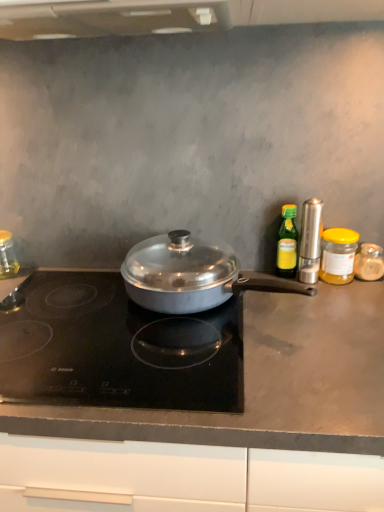
Question: Considering the relative positions of translucent glass jar at right, placed as the sixth kitchen appliance when sorted from left to right, and green glass bottle at right, which is the fourth kitchen appliance from right to left, in the image provided, is translucent glass jar at right, placed as the sixth kitchen appliance when sorted from left to right, behind green glass bottle at right, which is the fourth kitchen appliance from right to left,?

Choices:
 (A) yes
 (B) no

Answer: (A)

Question: From the image's perspective, is translucent glass jar at right, which is counted as the 1th kitchen appliance, starting from the right, on top of green glass bottle at right, which is the fourth kitchen appliance from right to left?

Choices:
 (A) yes
 (B) no

Answer: (B)

Question: Does translucent glass jar at right, placed as the sixth kitchen appliance when sorted from left to right, turn towards green glass bottle at right, which is the fourth kitchen appliance from right to left?

Choices:
 (A) no
 (B) yes

Answer: (A)

Question: Considering the relative sizes of translucent glass jar at right, placed as the sixth kitchen appliance when sorted from left to right, and green glass bottle at right, acting as the third kitchen appliance starting from the left, in the image provided, is translucent glass jar at right, placed as the sixth kitchen appliance when sorted from left to right, wider than green glass bottle at right, acting as the third kitchen appliance starting from the left,?

Choices:
 (A) yes
 (B) no

Answer: (A)

Question: Would you consider translucent glass jar at right, placed as the sixth kitchen appliance when sorted from left to right, to be distant from green glass bottle at right, acting as the third kitchen appliance starting from the left?

Choices:
 (A) yes
 (B) no

Answer: (B)

Question: Is green glass bottle at right, acting as the third kitchen appliance starting from the left, inside translucent glass jar at right, which is counted as the 1th kitchen appliance, starting from the right?

Choices:
 (A) yes
 (B) no

Answer: (B)

Question: Considering the relative sizes of satin silver pepper mill at right, acting as the third kitchen appliance starting from the right, and green glass bottle at right, which is the fourth kitchen appliance from right to left, in the image provided, is satin silver pepper mill at right, acting as the third kitchen appliance starting from the right, thinner than green glass bottle at right, which is the fourth kitchen appliance from right to left,?

Choices:
 (A) no
 (B) yes

Answer: (A)

Question: Is satin silver pepper mill at right, the 4th kitchen appliance positioned from the left, oriented towards green glass bottle at right, acting as the third kitchen appliance starting from the left?

Choices:
 (A) yes
 (B) no

Answer: (B)

Question: From a real-world perspective, is satin silver pepper mill at right, acting as the third kitchen appliance starting from the right, over green glass bottle at right, which is the fourth kitchen appliance from right to left?

Choices:
 (A) no
 (B) yes

Answer: (B)

Question: Is the depth of satin silver pepper mill at right, acting as the third kitchen appliance starting from the right, greater than that of green glass bottle at right, acting as the third kitchen appliance starting from the left?

Choices:
 (A) yes
 (B) no

Answer: (B)

Question: From a real-world perspective, is satin silver pepper mill at right, the 4th kitchen appliance positioned from the left, physically below green glass bottle at right, which is the fourth kitchen appliance from right to left?

Choices:
 (A) no
 (B) yes

Answer: (A)

Question: Can you confirm if satin silver pepper mill at right, acting as the third kitchen appliance starting from the right, is bigger than green glass bottle at right, which is the fourth kitchen appliance from right to left?

Choices:
 (A) no
 (B) yes

Answer: (B)

Question: Does yellow glass jar at right, arranged as the fifth kitchen appliance when viewed from the left, have a greater height compared to satin silver pepper mill at right, acting as the third kitchen appliance starting from the right?

Choices:
 (A) no
 (B) yes

Answer: (A)